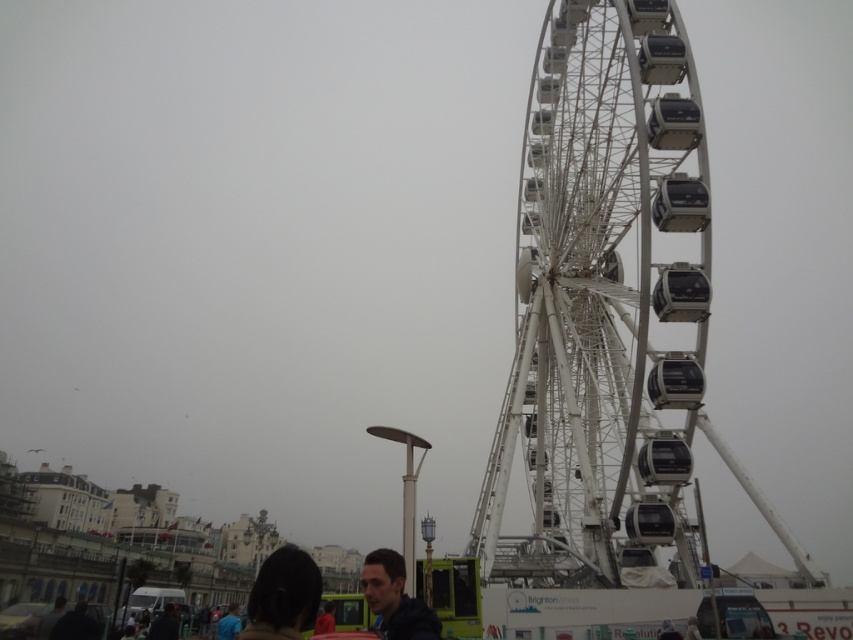
Question: Does white metallic ferris wheel at center have a larger size compared to blue fabric shirt at lower left?

Choices:
 (A) no
 (B) yes

Answer: (B)

Question: Which point is closer to the camera?

Choices:
 (A) (318, 627)
 (B) (276, 612)

Answer: (B)

Question: Among these points, which one is nearest to the camera?

Choices:
 (A) (260, 579)
 (B) (331, 609)
 (C) (614, 120)
 (D) (230, 636)

Answer: (A)

Question: Is matte blue jacket at lower center closer to the viewer compared to dark hair at lower center?

Choices:
 (A) yes
 (B) no

Answer: (A)

Question: Which point is closer to the camera taking this photo?

Choices:
 (A) (334, 621)
 (B) (579, 253)

Answer: (A)

Question: Is white metallic ferris wheel at center smaller than dark brown hair at lower center?

Choices:
 (A) no
 (B) yes

Answer: (B)